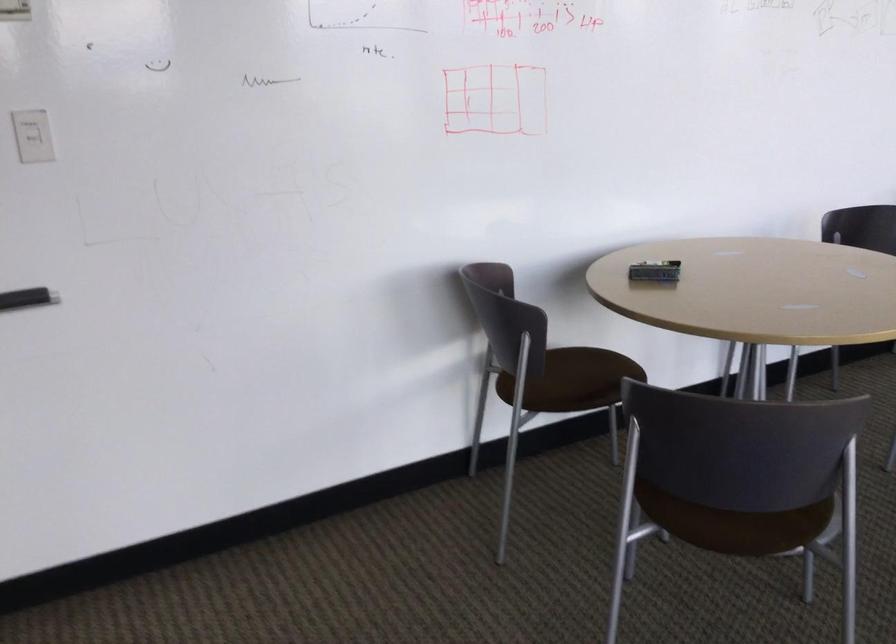
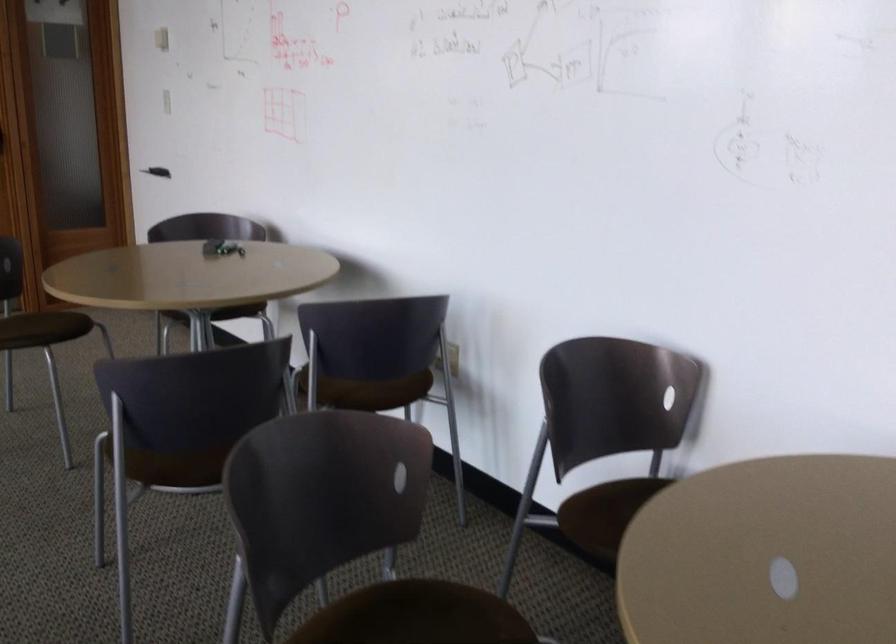
Where in the second image is the point corresponding to the point at 674,281 from the first image?

(221, 248)